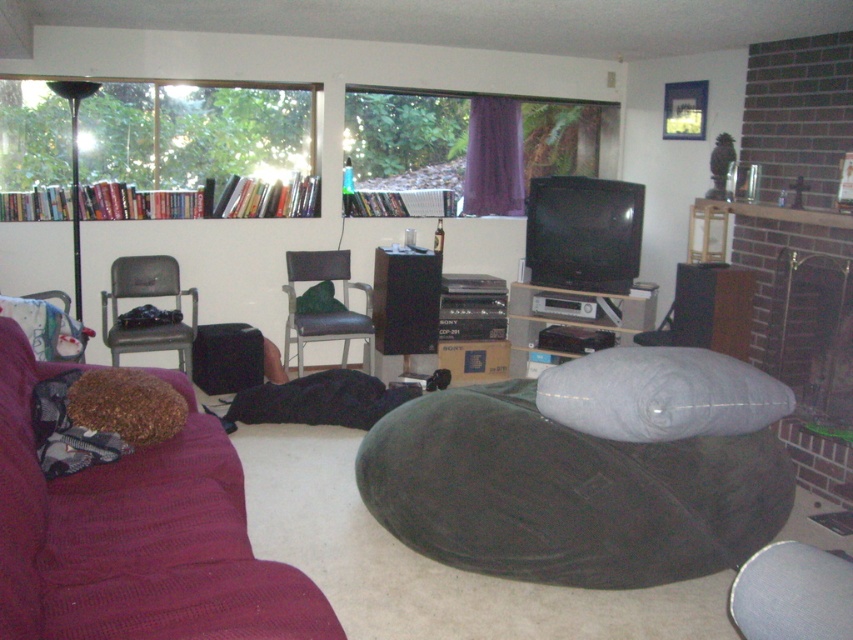
Question: Is maroon fabric couch at lower left to the left of metallic gray chair at left from the viewer's perspective?

Choices:
 (A) yes
 (B) no

Answer: (B)

Question: Which point is farther to the camera?

Choices:
 (A) (151, 259)
 (B) (341, 333)
 (C) (675, 440)

Answer: (A)

Question: Does metallic gray chair at left come in front of black leather chair at center?

Choices:
 (A) no
 (B) yes

Answer: (B)

Question: Is metallic gray chair at left below black leather chair at center?

Choices:
 (A) no
 (B) yes

Answer: (A)

Question: Estimate the real-world distances between objects in this image. Which object is farther from the black matte speaker at center?

Choices:
 (A) maroon fabric couch at lower left
 (B) metallic gray chair at left
 (C) gray fabric pillow at center

Answer: (A)

Question: Estimate the real-world distances between objects in this image. Which object is closer to the dark gray fabric bean bag at center?

Choices:
 (A) matte gray electronics at center
 (B) black matte speaker at center
 (C) black leather chair at center
 (D) gray fabric pillow at center

Answer: (D)